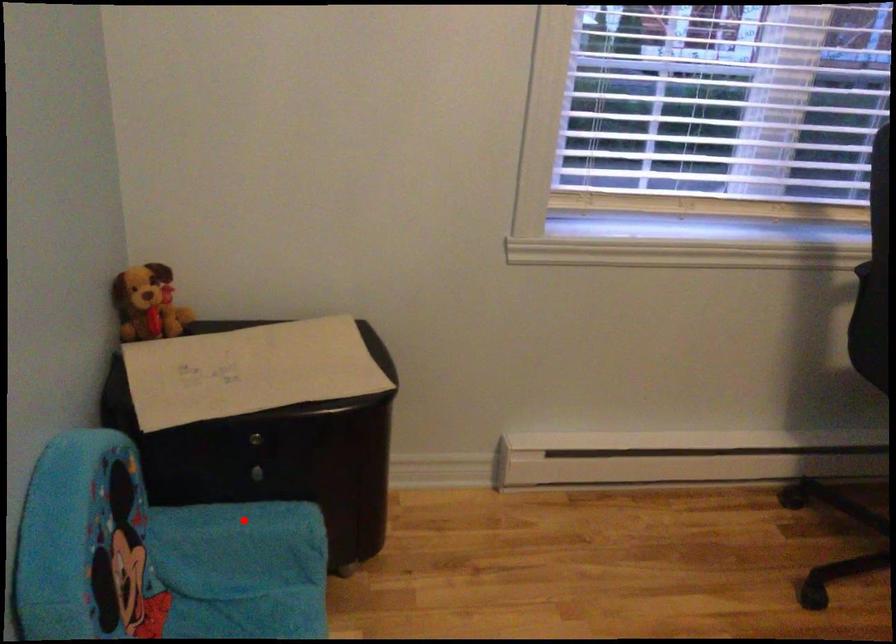
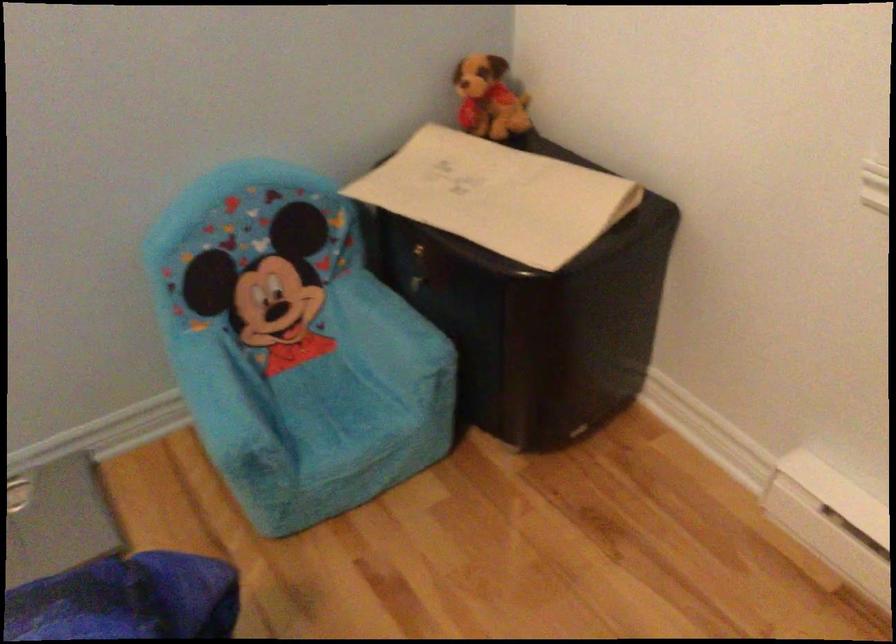
The point at the highlighted location is marked in the first image. Where is the corresponding point in the second image?

(389, 316)